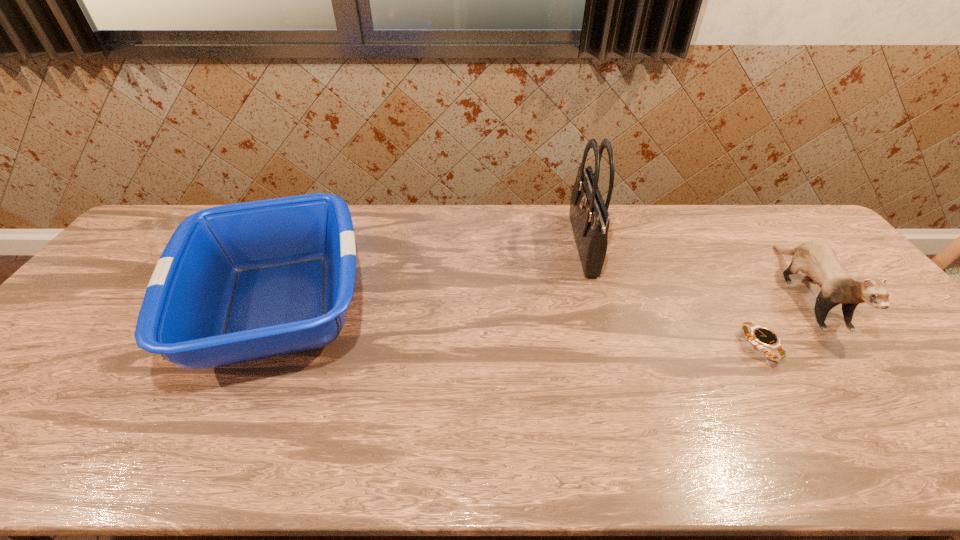
This screenshot has width=960, height=540. I want to click on vacant space at the right edge of the desktop, so click(x=940, y=397).

Where is `free space at the far left corner of the desktop`? This screenshot has width=960, height=540. free space at the far left corner of the desktop is located at coordinates (201, 208).

Identify the location of free spot at the far right corner of the desktop. (801, 230).

Image resolution: width=960 pixels, height=540 pixels. In order to click on blank region between the ferret and the tray in this screenshot , I will do click(x=543, y=299).

The height and width of the screenshot is (540, 960). I want to click on vacant space that's between the ferret and the watch, so click(783, 319).

The height and width of the screenshot is (540, 960). Find the location of `free area in between the second object from right to left and the second object from left to right`. free area in between the second object from right to left and the second object from left to right is located at coordinates (671, 296).

What are the coordinates of `vacant area between the leftmost object and the watch` in the screenshot? It's located at (518, 327).

This screenshot has width=960, height=540. I want to click on free point between the third object from left to right and the tray, so click(518, 327).

Image resolution: width=960 pixels, height=540 pixels. What are the coordinates of `vacant point located between the leftmost object and the rightmost object` in the screenshot? It's located at (543, 299).

Find the location of a particular element. Image resolution: width=960 pixels, height=540 pixels. vacant point located between the third object from left to right and the rightmost object is located at coordinates (783, 319).